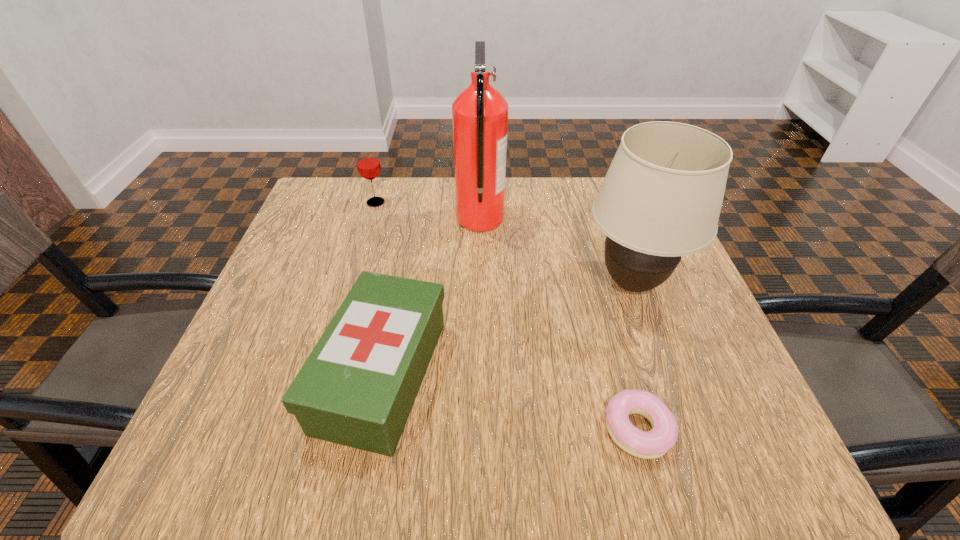
Locate an element on the screen. The width and height of the screenshot is (960, 540). free space between the lampshade and the glass is located at coordinates (504, 242).

Where is `vacant space that's between the lampshade and the glass`? The image size is (960, 540). vacant space that's between the lampshade and the glass is located at coordinates [x=504, y=242].

Find the location of a particular element. The height and width of the screenshot is (540, 960). free spot between the fourth tallest object and the lampshade is located at coordinates (507, 329).

Find the location of a particular element. The width and height of the screenshot is (960, 540). empty location between the lampshade and the third object from left to right is located at coordinates tap(556, 251).

The image size is (960, 540). In order to click on free area in between the shortest object and the fire extinguisher in this screenshot , I will do `click(559, 324)`.

Locate an element on the screen. free space between the doughnut and the fire extinguisher is located at coordinates (559, 324).

Where is `free space that is in between the shortest object and the lampshade`? free space that is in between the shortest object and the lampshade is located at coordinates (635, 356).

Find the location of a particular element. object that is the third closest to the fourth tallest object is located at coordinates [x=661, y=198].

At what (x,y) coordinates should I click in order to perform the action: click on object that stands as the fourth closest to the doughnut. Please return your answer as a coordinate pair (x, y). Looking at the image, I should click on (368, 164).

You are a GUI agent. You are given a task and a screenshot of the screen. Output one action in this format:
    pyautogui.click(x=<x>, y=<y>)
    Task: Click on the vacant space that satisfies the following two spatial constraints: 1. at the nozzle of the tallest object; 2. on the front side of the fourth tallest object
    
    Given the screenshot: What is the action you would take?
    pyautogui.click(x=480, y=375)